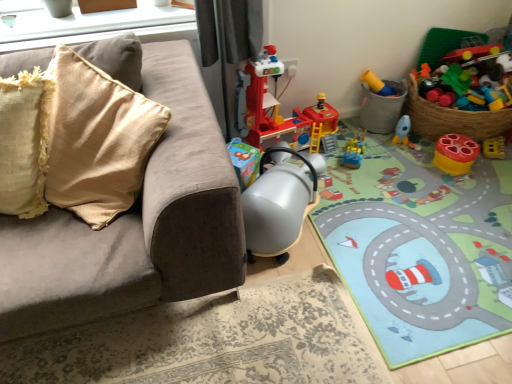
Question: Could you tell me if translucent plastic toy at upper right, which is the 1th toy from right to left, is turned towards matte plastic rocket at lower right, which appears as the 3th toy when viewed from the right?

Choices:
 (A) yes
 (B) no

Answer: (B)

Question: Does translucent plastic toy at upper right, which is the sixth toy in left-to-right order, have a greater height compared to matte plastic rocket at lower right, the fourth toy positioned from the left?

Choices:
 (A) no
 (B) yes

Answer: (B)

Question: From the image's perspective, is translucent plastic toy at upper right, which is the sixth toy in left-to-right order, below matte plastic rocket at lower right, the fourth toy positioned from the left?

Choices:
 (A) no
 (B) yes

Answer: (A)

Question: Is translucent plastic toy at upper right, which is the sixth toy in left-to-right order, bigger than matte plastic rocket at lower right, the fourth toy positioned from the left?

Choices:
 (A) no
 (B) yes

Answer: (B)

Question: Is translucent plastic toy at upper right, which is the 1th toy from right to left, further to the viewer compared to matte plastic rocket at lower right, the fourth toy positioned from the left?

Choices:
 (A) no
 (B) yes

Answer: (B)

Question: From the image's perspective, does translucent plastic toy at upper right, which is the sixth toy in left-to-right order, appear higher than matte plastic rocket at lower right, the fourth toy positioned from the left?

Choices:
 (A) no
 (B) yes

Answer: (B)

Question: Does carpeted play mat at center lie behind translucent plastic toy at upper right, which is the 1th toy from right to left?

Choices:
 (A) no
 (B) yes

Answer: (A)

Question: Is the position of carpeted play mat at center less distant than that of translucent plastic toy at upper right, which is the 1th toy from right to left?

Choices:
 (A) yes
 (B) no

Answer: (A)

Question: Considering the relative positions of carpeted play mat at center and translucent plastic toy at upper right, which is the 1th toy from right to left, in the image provided, is carpeted play mat at center to the left of translucent plastic toy at upper right, which is the 1th toy from right to left, from the viewer's perspective?

Choices:
 (A) yes
 (B) no

Answer: (A)

Question: Can you confirm if carpeted play mat at center is thinner than translucent plastic toy at upper right, which is the 1th toy from right to left?

Choices:
 (A) yes
 (B) no

Answer: (B)

Question: Is carpeted play mat at center surrounding translucent plastic toy at upper right, which is the sixth toy in left-to-right order?

Choices:
 (A) no
 (B) yes

Answer: (A)

Question: From a real-world perspective, is carpeted play mat at center located beneath translucent plastic toy at upper right, which is the 1th toy from right to left?

Choices:
 (A) yes
 (B) no

Answer: (A)

Question: From a real-world perspective, is plastic yellow toy at upper right, which is the third toy in left-to-right order, on matte plastic toy at right, marked as the second toy in a right-to-left arrangement?

Choices:
 (A) yes
 (B) no

Answer: (A)